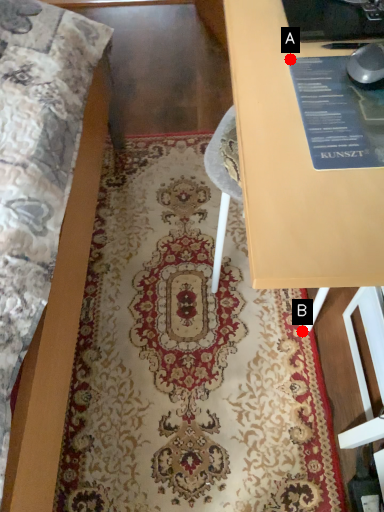
Question: Two points are circled on the image, labeled by A and B beside each circle. Among these points, which one is nearest to the camera?

Choices:
 (A) A is closer
 (B) B is closer

Answer: (A)